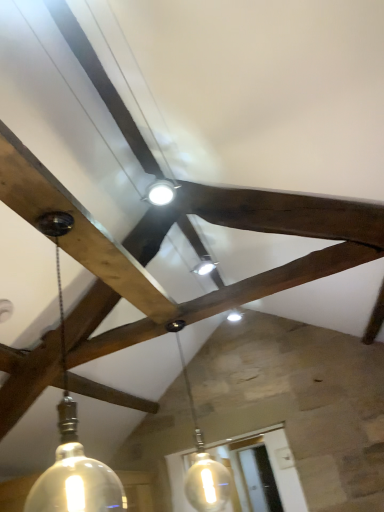
Question: Considering their positions, is matte glass pendant light at left, acting as the first lamp starting from the front, located in front of or behind translucent glass pendant light at center, positioned as the first lamp in back-to-front order?

Choices:
 (A) behind
 (B) front

Answer: (B)

Question: From a real-world perspective, is matte glass pendant light at left, acting as the first lamp starting from the front, above or below translucent glass pendant light at center, positioned as the first lamp in back-to-front order?

Choices:
 (A) below
 (B) above

Answer: (B)

Question: In the image, is matte glass pendant light at left, acting as the first lamp starting from the front, on the left side or the right side of translucent glass pendant light at center, the 2th lamp viewed from the front?

Choices:
 (A) left
 (B) right

Answer: (A)

Question: Is translucent glass pendant light at center, positioned as the first lamp in back-to-front order, in front of or behind matte glass pendant light at left, acting as the first lamp starting from the front, in the image?

Choices:
 (A) behind
 (B) front

Answer: (A)

Question: Would you say translucent glass pendant light at center, positioned as the first lamp in back-to-front order, is to the left or to the right of matte glass pendant light at left, which is the 2th lamp from back to front, in the picture?

Choices:
 (A) left
 (B) right

Answer: (B)

Question: In terms of height, does translucent glass pendant light at center, positioned as the first lamp in back-to-front order, look taller or shorter compared to matte glass pendant light at left, which is the 2th lamp from back to front?

Choices:
 (A) tall
 (B) short

Answer: (A)

Question: Is translucent glass pendant light at center, positioned as the first lamp in back-to-front order, bigger or smaller than matte glass pendant light at left, which is the 2th lamp from back to front?

Choices:
 (A) small
 (B) big

Answer: (B)